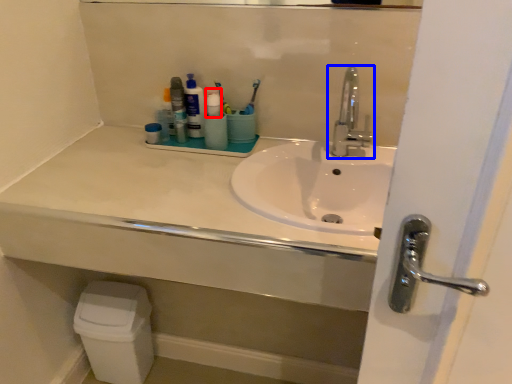
Question: Which object appears farthest to the camera in this image, toiletry (highlighted by a red box) or tap (highlighted by a blue box)?

Choices:
 (A) toiletry
 (B) tap

Answer: (A)